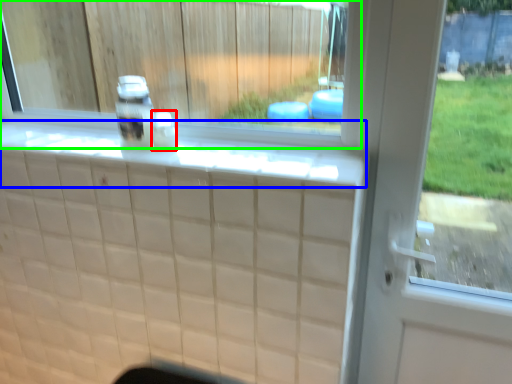
Question: Considering the real-world distances, which object is closest to bottle (highlighted by a red box)? ledge (highlighted by a blue box) or window (highlighted by a green box).

Choices:
 (A) ledge
 (B) window

Answer: (A)